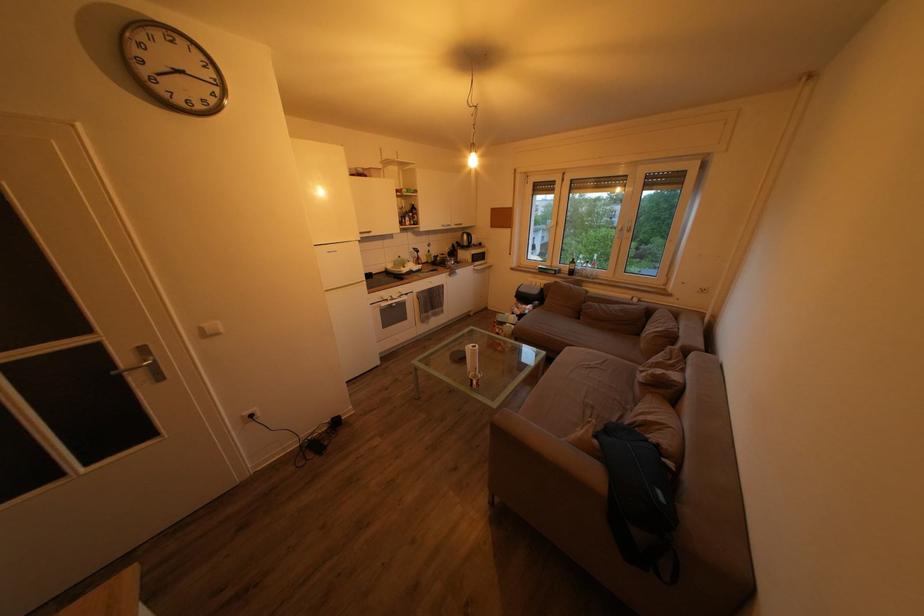
Where would you pour the black electric kettle? Please return your answer as a coordinate pair (x, y).

(465, 238)